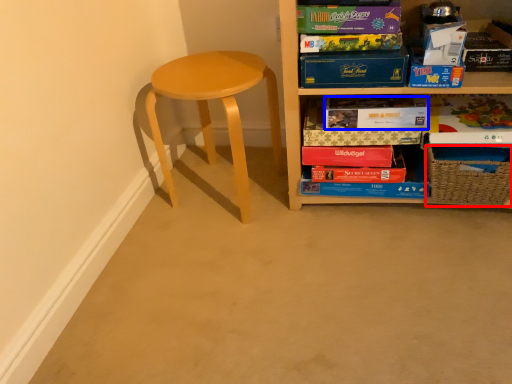
Question: Which of the following is the closest to the observer, basket (highlighted by a red box) or paperback book (highlighted by a blue box)?

Choices:
 (A) basket
 (B) paperback book

Answer: (A)